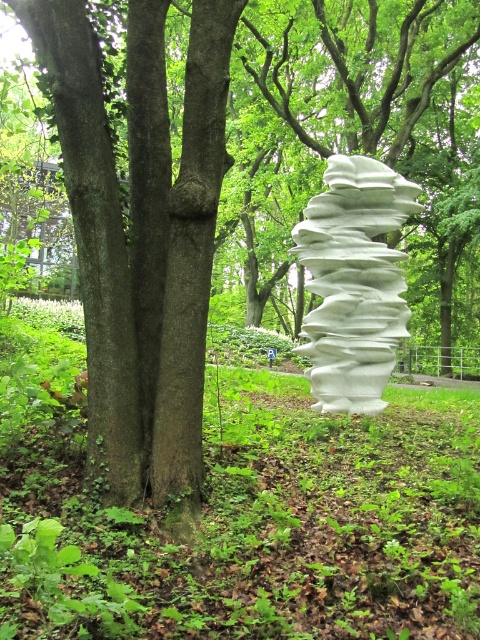
Can you confirm if white matte sculpture at right is shorter than white matte sculpture at center?

Yes.

Is white matte sculpture at right smaller than white matte sculpture at center?

Indeed, white matte sculpture at right has a smaller size compared to white matte sculpture at center.

This screenshot has width=480, height=640. I want to click on white matte sculpture at right, so click(x=240, y=512).

The width and height of the screenshot is (480, 640). I want to click on white matte sculpture at right, so pos(240,512).